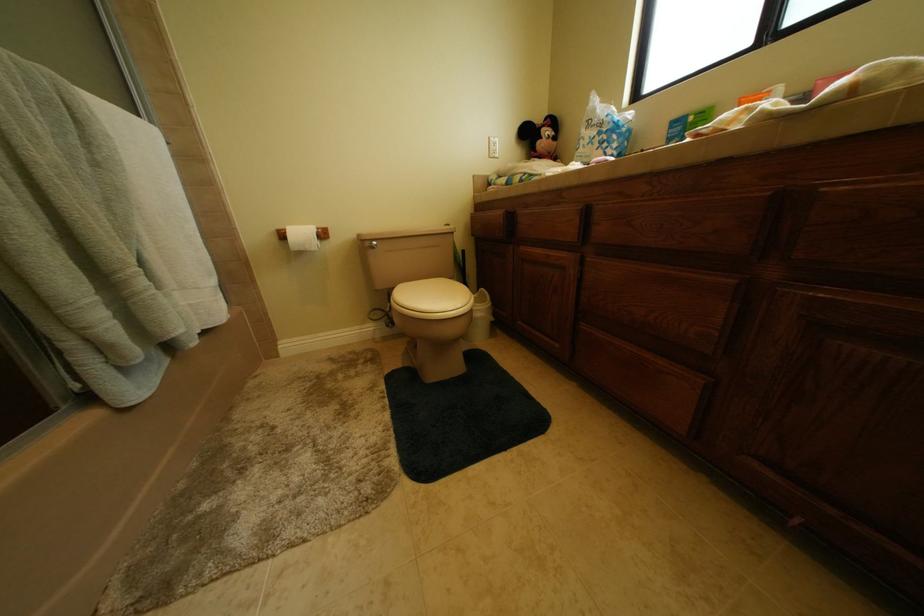
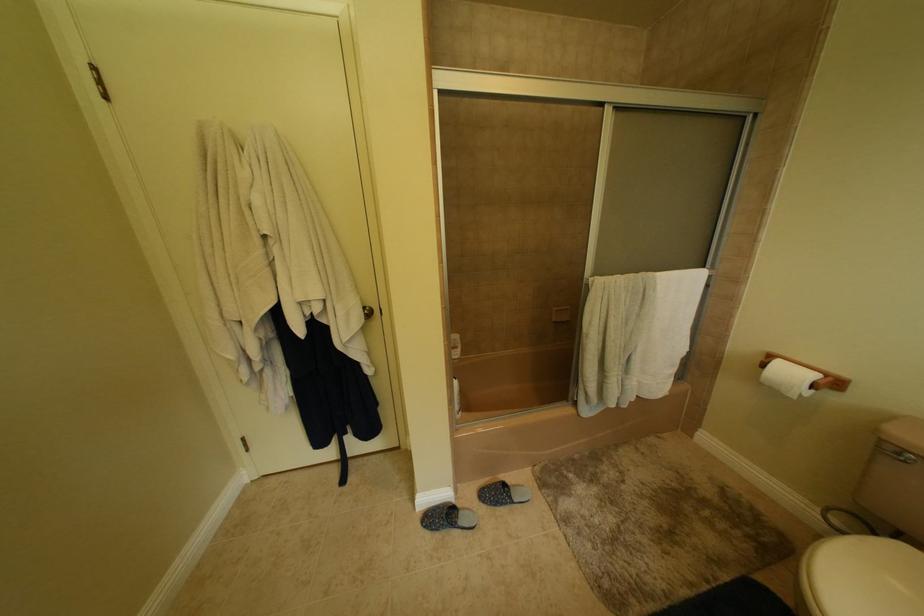
First-person continuous shooting, in which direction is the camera rotating?

The camera rotated toward left-down.